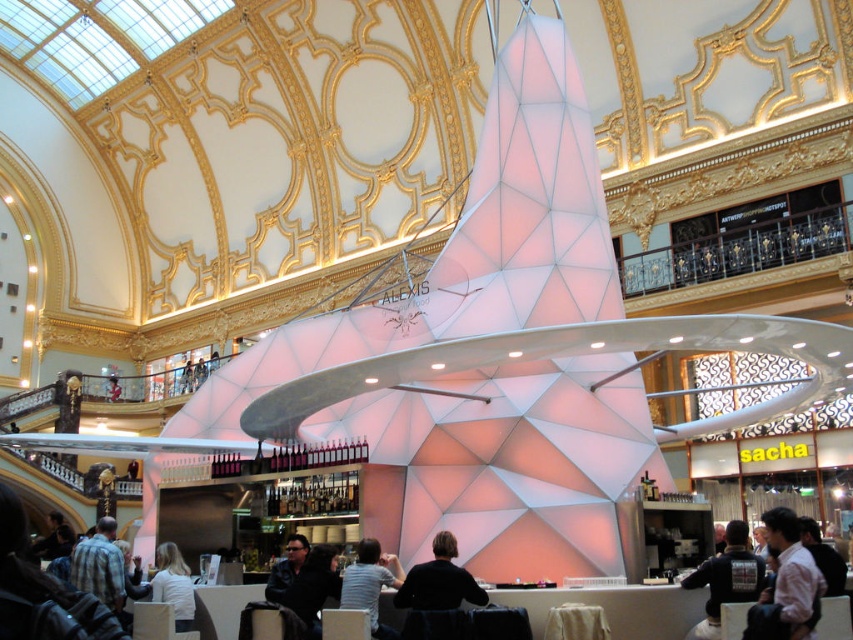
Question: Which object is positioned closest to the white matte shirt at lower center?

Choices:
 (A) dark brown leather jacket at lower right
 (B) striped shirt at center

Answer: (B)

Question: Can you confirm if light pink shirt at lower right is smaller than dark hair at lower left?

Choices:
 (A) yes
 (B) no

Answer: (A)

Question: Which point is closer to the camera taking this photo?

Choices:
 (A) (90, 582)
 (B) (469, 602)
 (C) (64, 528)

Answer: (B)

Question: Which of the following is the farthest from the observer?

Choices:
 (A) (822, 563)
 (B) (804, 577)

Answer: (A)

Question: Is silhouette leather jacket at center to the right of striped shirt at center from the viewer's perspective?

Choices:
 (A) yes
 (B) no

Answer: (A)

Question: Can you confirm if dark blue jacket at lower right is wider than dark hair at lower left?

Choices:
 (A) no
 (B) yes

Answer: (A)